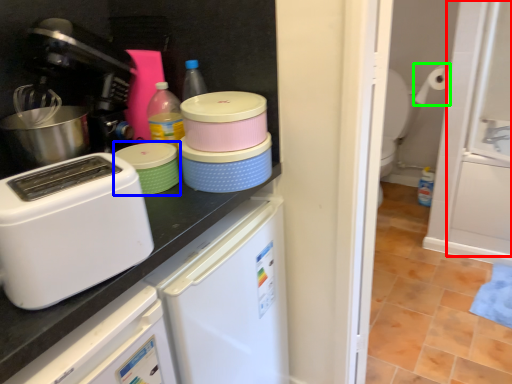
Question: Considering the real-world distances, which object is closest to screen door (highlighted by a red box)? appliance (highlighted by a blue box) or toilet paper (highlighted by a green box).

Choices:
 (A) appliance
 (B) toilet paper

Answer: (B)